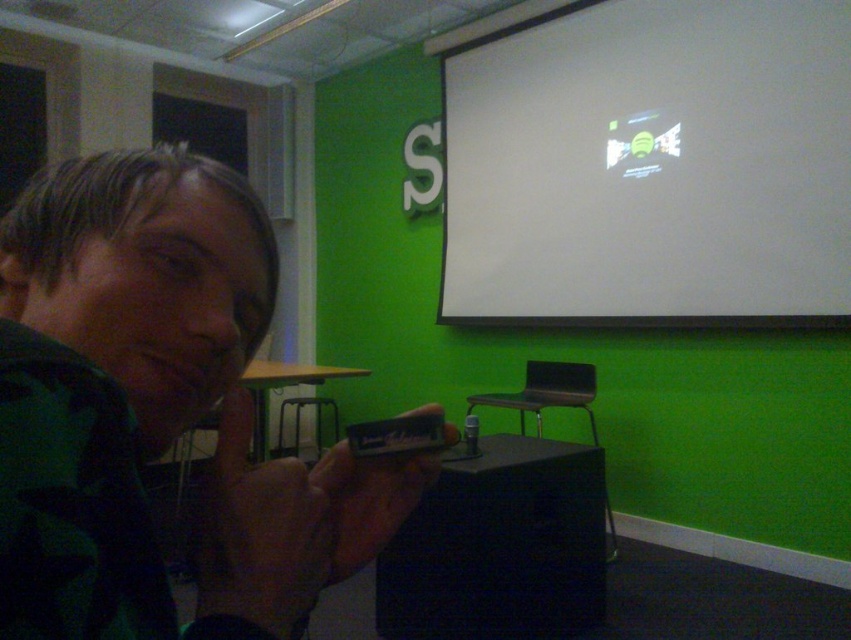
You are organizing a photo shoot in this room and need to ensure that the green camouflage shirt at left and the white matte projection screen at upper center are both visible in the frame. Based on their sizes, which object should you prioritize positioning closer to the camera to maintain clarity?

The green camouflage shirt at left should be positioned closer to the camera since it occupies less space than the white matte projection screen at upper center, ensuring both objects are clearly visible in the frame.

You are organizing a photo shoot in the room. You need to place a 2m wide backdrop behind the green camouflage shirt at left and the white matte projection screen at upper center. Which object should the backdrop be placed behind to ensure it fits without overlapping?

The backdrop should be placed behind the white matte projection screen at upper center because the green camouflage shirt at left has a lesser width compared to the white matte projection screen at upper center, so the wider object requires a larger backdrop to avoid overlapping.

In the scene described, there is a green camouflage shirt at left and a white matte projection screen at upper center. From the perspective of someone standing in the room, which object is positioned more to the left?

The green camouflage shirt at left is positioned more to the left than the white matte projection screen at upper center.